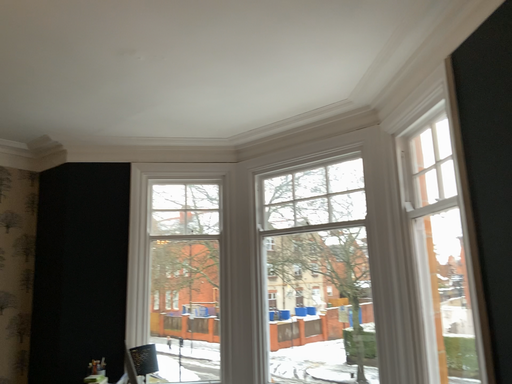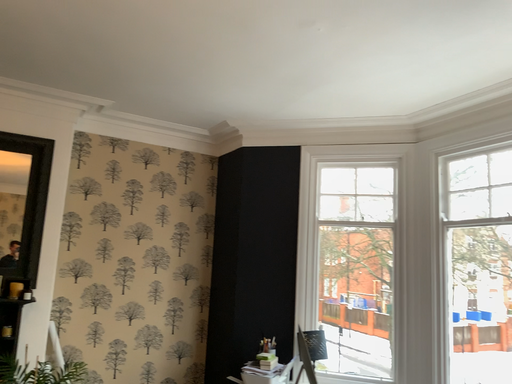
Question: Which way did the camera rotate in the video?

Choices:
 (A) rotated right
 (B) rotated left

Answer: (B)